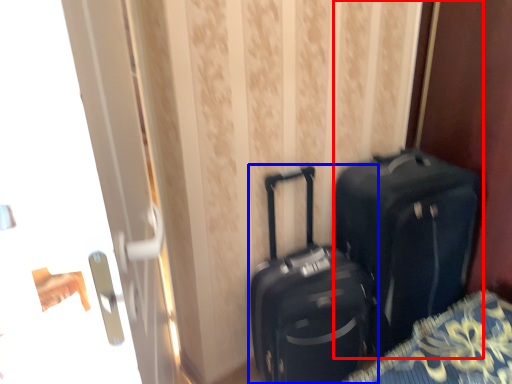
Question: Which point is closer to the camera, luggage and bags (highlighted by a red box) or suitcase (highlighted by a blue box)?

Choices:
 (A) luggage and bags
 (B) suitcase

Answer: (B)